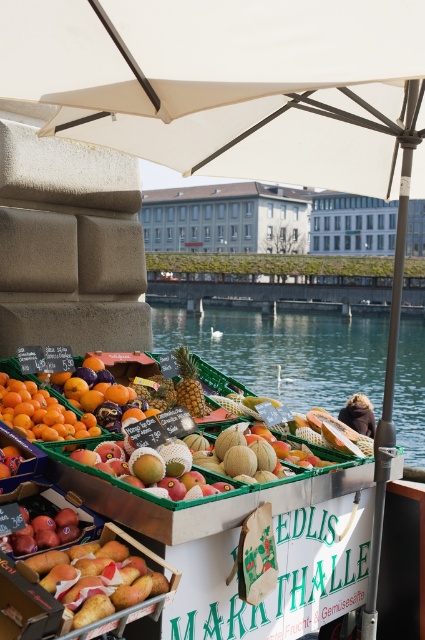
Question: Can you confirm if orange matte/orange melon at lower left is positioned to the left of smooth brown vendor at center?

Choices:
 (A) no
 (B) yes

Answer: (B)

Question: Is smooth yellow mango at center to the right of shiny purple eggplant at center from the viewer's perspective?

Choices:
 (A) yes
 (B) no

Answer: (A)

Question: Which object appears closest to the camera in this image?

Choices:
 (A) smooth yellow mango at center
 (B) transparent water at center

Answer: (A)

Question: Can you confirm if transparent water at center is wider than orange matte/orange melon at lower left?

Choices:
 (A) no
 (B) yes

Answer: (B)

Question: Based on their relative distances, which object is nearer to the yellow matte pineapple at center?

Choices:
 (A) smooth yellow mango at center
 (B) transparent water at center
 (C) smooth brown vendor at center

Answer: (A)

Question: Which point appears farthest from the camera in this image?

Choices:
 (A) (368, 380)
 (B) (62, 374)
 (C) (184, 364)
 (D) (357, 397)

Answer: (A)